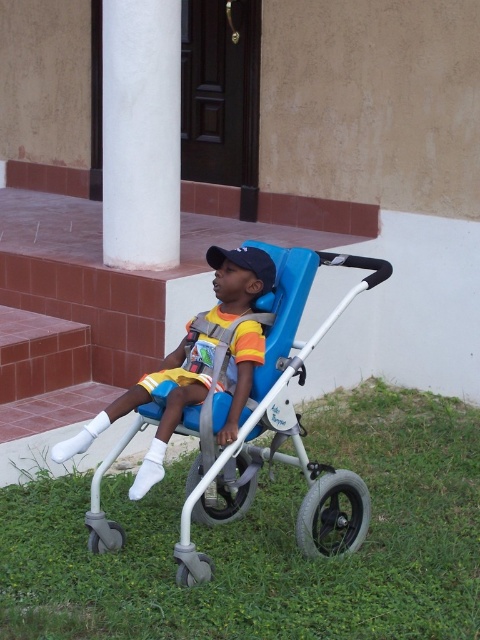
Find the location of a particular element. This screenshot has height=640, width=480. white smooth column at upper left is located at coordinates (141, 132).

Is point (121, 208) behind point (257, 273)?

That is True.

In order to click on white smooth column at upper left in this screenshot , I will do `click(141, 132)`.

Where is `white smooth column at upper left`? The image size is (480, 640). white smooth column at upper left is located at coordinates click(x=141, y=132).

Based on the photo, does white smooth column at upper left appear over matte blue stroller at center?

Indeed, white smooth column at upper left is positioned over matte blue stroller at center.

Which is behind, point (142, 236) or point (242, 294)?

The point (142, 236) is behind.

Which is in front, point (104, 1) or point (156, 371)?

Point (104, 1) is in front.

You are a GUI agent. You are given a task and a screenshot of the screen. Output one action in this format:
    pyautogui.click(x=<x>, y=<y>)
    Task: Click on the white smooth column at upper left
    The height and width of the screenshot is (640, 480).
    Given the screenshot: What is the action you would take?
    pyautogui.click(x=141, y=132)

Does blue plastic baby carriage at center appear under blue matte baseball cap at center?

Correct, blue plastic baby carriage at center is located below blue matte baseball cap at center.

Which is above, blue plastic baby carriage at center or blue matte baseball cap at center?

Positioned higher is blue matte baseball cap at center.

Locate an element on the screen. Image resolution: width=480 pixels, height=640 pixels. blue plastic baby carriage at center is located at coordinates (241, 420).

The width and height of the screenshot is (480, 640). Find the location of `blue plastic baby carriage at center`. blue plastic baby carriage at center is located at coordinates (241, 420).